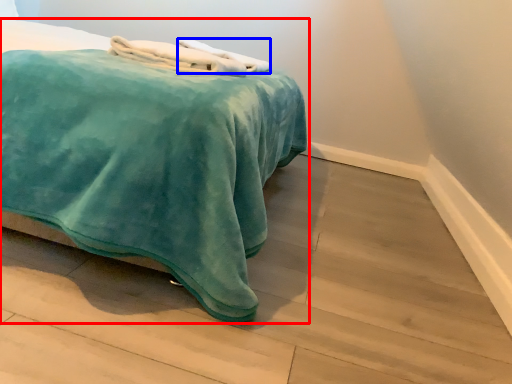
Question: Among these objects, which one is farthest to the camera, bed (highlighted by a red box) or bath towel (highlighted by a blue box)?

Choices:
 (A) bed
 (B) bath towel

Answer: (B)